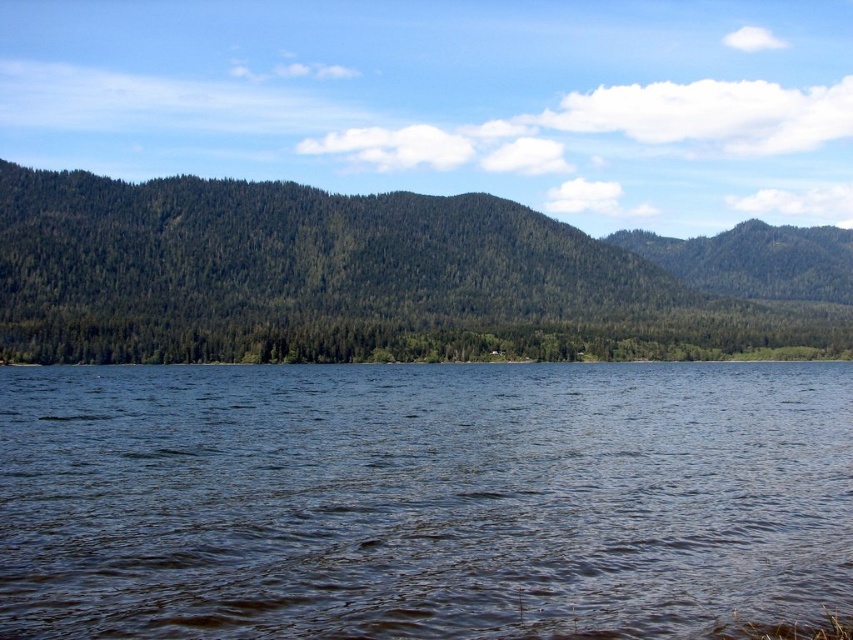
Is dark blue water at center to the left of green textured forest at center from the viewer's perspective?

Correct, you'll find dark blue water at center to the left of green textured forest at center.

The height and width of the screenshot is (640, 853). What do you see at coordinates (422, 499) in the screenshot?
I see `dark blue water at center` at bounding box center [422, 499].

At what (x,y) coordinates should I click in order to perform the action: click on dark blue water at center. Please return your answer as a coordinate pair (x, y). Looking at the image, I should click on (422, 499).